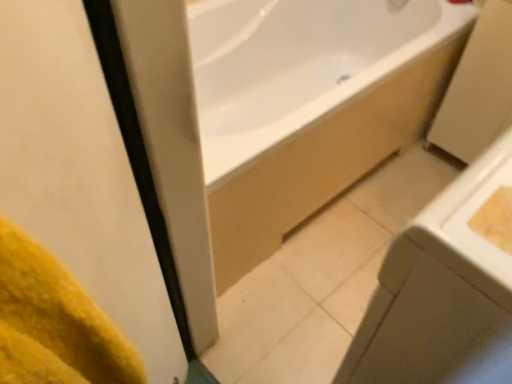
Question: Is white glossy sink at lower right to the left of yellow fabric at left from the viewer's perspective?

Choices:
 (A) yes
 (B) no

Answer: (B)

Question: From the image's perspective, would you say white glossy sink at lower right is positioned over yellow fabric at left?

Choices:
 (A) no
 (B) yes

Answer: (B)

Question: Is white glossy sink at lower right positioned in front of yellow fabric at left?

Choices:
 (A) no
 (B) yes

Answer: (A)

Question: Does white glossy sink at lower right have a greater height compared to yellow fabric at left?

Choices:
 (A) no
 (B) yes

Answer: (A)

Question: Is white glossy sink at lower right positioned with its back to yellow fabric at left?

Choices:
 (A) yes
 (B) no

Answer: (B)

Question: Relative to white glossy bathtub at upper center, is white glossy sink at lower right in front or behind?

Choices:
 (A) front
 (B) behind

Answer: (A)

Question: From a real-world perspective, is white glossy sink at lower right physically located above or below white glossy bathtub at upper center?

Choices:
 (A) below
 (B) above

Answer: (B)

Question: Considering the positions of white glossy sink at lower right and white glossy bathtub at upper center in the image, is white glossy sink at lower right taller or shorter than white glossy bathtub at upper center?

Choices:
 (A) tall
 (B) short

Answer: (A)

Question: Looking at their shapes, would you say white glossy sink at lower right is wider or thinner than white glossy bathtub at upper center?

Choices:
 (A) thin
 (B) wide

Answer: (A)

Question: Is white glossy bathtub at upper center in front of or behind yellow fabric at left in the image?

Choices:
 (A) front
 (B) behind

Answer: (B)

Question: From the image's perspective, is white glossy bathtub at upper center above or below yellow fabric at left?

Choices:
 (A) above
 (B) below

Answer: (A)

Question: From a real-world perspective, is white glossy bathtub at upper center physically located above or below yellow fabric at left?

Choices:
 (A) above
 (B) below

Answer: (B)

Question: Based on their sizes in the image, would you say white glossy bathtub at upper center is bigger or smaller than yellow fabric at left?

Choices:
 (A) big
 (B) small

Answer: (A)

Question: In terms of size, does yellow fabric at left appear bigger or smaller than white glossy sink at lower right?

Choices:
 (A) big
 (B) small

Answer: (B)

Question: Does point (100, 31) appear closer or farther from the camera than point (464, 276)?

Choices:
 (A) farther
 (B) closer

Answer: (B)